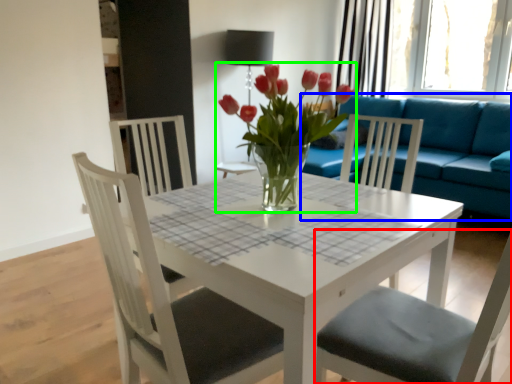
Question: Estimate the real-world distances between objects in this image. Which object is closer to chair (highlighted by a red box), studio couch (highlighted by a blue box) or houseplant (highlighted by a green box)?

Choices:
 (A) studio couch
 (B) houseplant

Answer: (B)